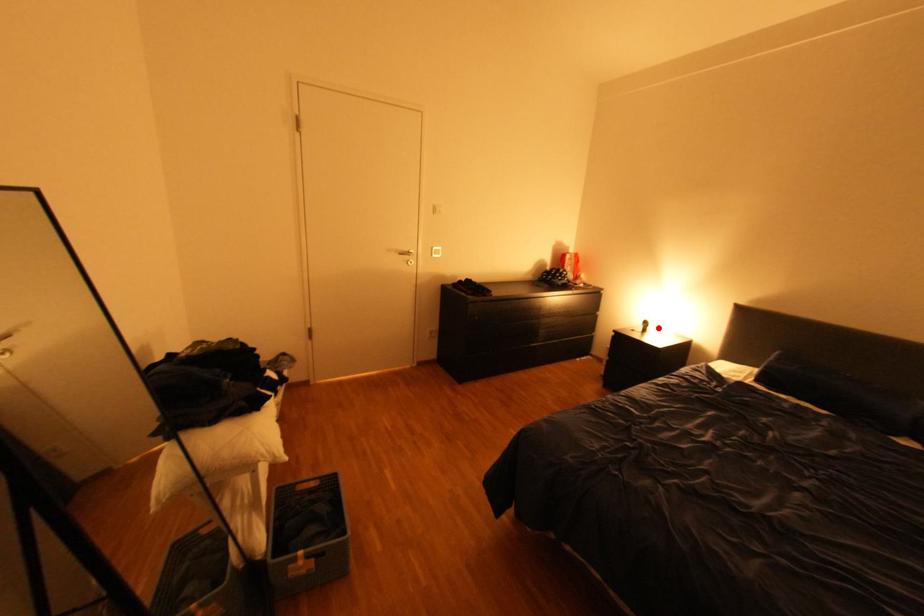
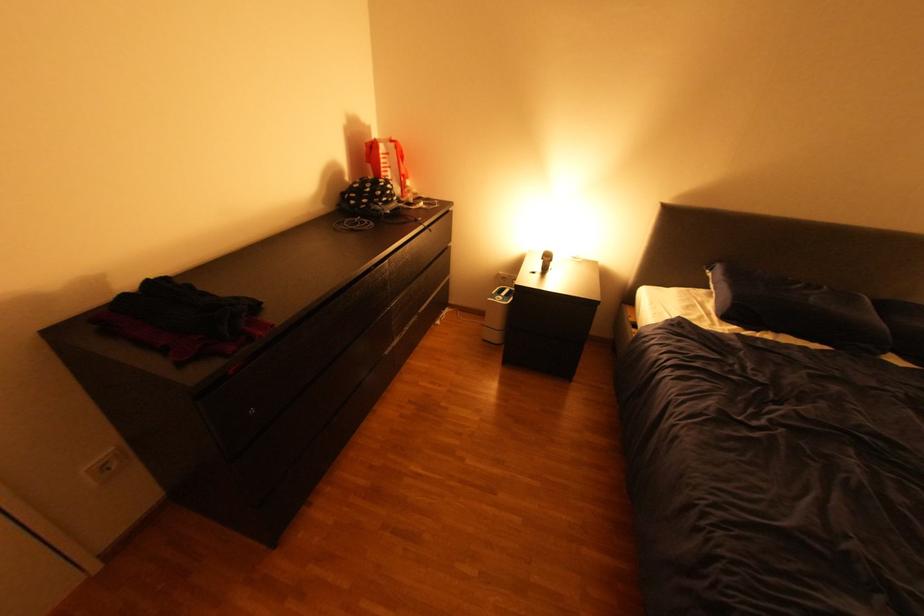
Locate, in the second image, the point that corresponds to the highlighted location in the first image.

(561, 262)